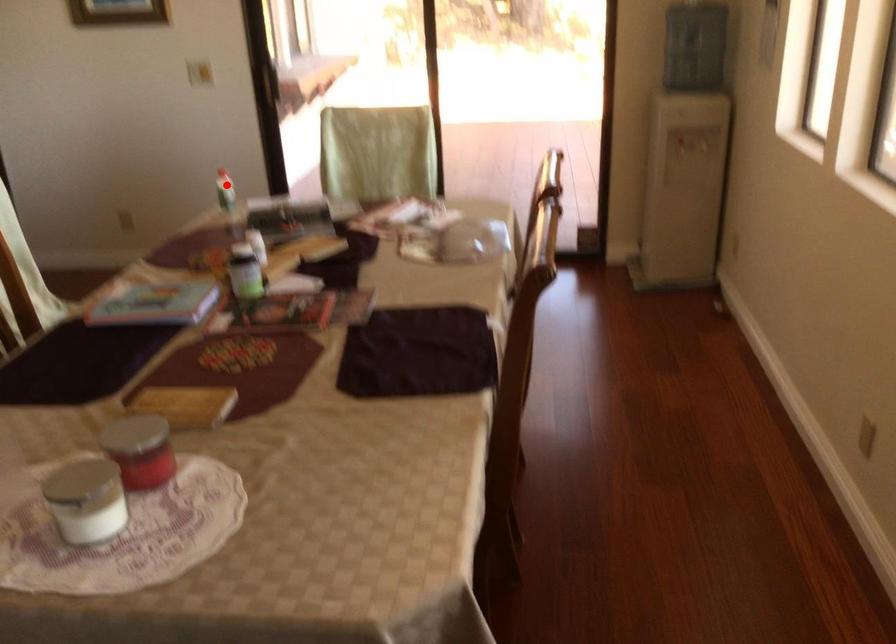
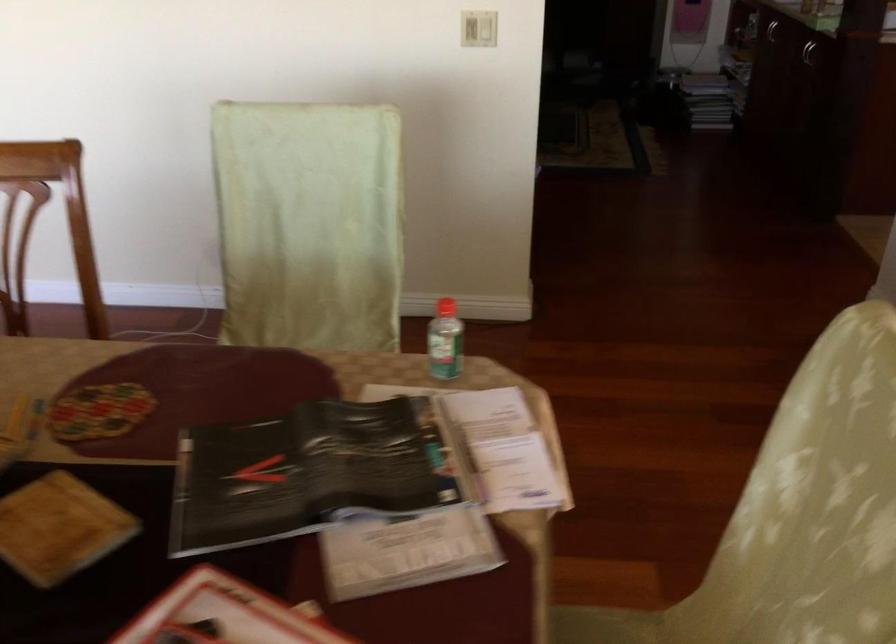
In the second image, find the point that corresponds to the highlighted location in the first image.

(444, 341)